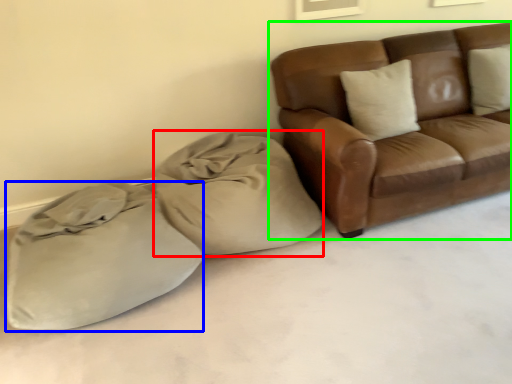
Question: Based on their relative distances, which object is farther from bean bag chair (highlighted by a red box)? Choose from sack (highlighted by a blue box) and studio couch (highlighted by a green box).

Choices:
 (A) sack
 (B) studio couch

Answer: (B)